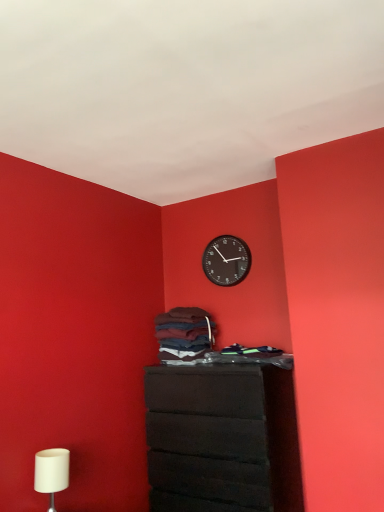
Question: From a real-world perspective, is black plastic wall clock at upper center on white matte table lamp at lower left?

Choices:
 (A) no
 (B) yes

Answer: (B)

Question: Does black plastic wall clock at upper center have a lesser height compared to white matte table lamp at lower left?

Choices:
 (A) no
 (B) yes

Answer: (A)

Question: Would you consider black plastic wall clock at upper center to be distant from white matte table lamp at lower left?

Choices:
 (A) no
 (B) yes

Answer: (B)

Question: Is black plastic wall clock at upper center bigger than white matte table lamp at lower left?

Choices:
 (A) no
 (B) yes

Answer: (A)

Question: Considering the relative sizes of black plastic wall clock at upper center and white matte table lamp at lower left in the image provided, is black plastic wall clock at upper center thinner than white matte table lamp at lower left?

Choices:
 (A) no
 (B) yes

Answer: (B)

Question: Is white matte table lamp at lower left bigger or smaller than matte black chest of drawers at center?

Choices:
 (A) small
 (B) big

Answer: (A)

Question: From a real-world perspective, relative to matte black chest of drawers at center, is white matte table lamp at lower left vertically above or below?

Choices:
 (A) above
 (B) below

Answer: (A)

Question: Considering the positions of white matte table lamp at lower left and matte black chest of drawers at center in the image, is white matte table lamp at lower left taller or shorter than matte black chest of drawers at center?

Choices:
 (A) tall
 (B) short

Answer: (B)

Question: Does point (54, 466) appear closer or farther from the camera than point (278, 371)?

Choices:
 (A) closer
 (B) farther

Answer: (A)

Question: In the image, is dark blue cotton laundry at center positioned in front of or behind white matte table lamp at lower left?

Choices:
 (A) front
 (B) behind

Answer: (B)

Question: Does point (155, 330) appear closer or farther from the camera than point (59, 472)?

Choices:
 (A) farther
 (B) closer

Answer: (A)

Question: Is dark blue cotton laundry at center bigger or smaller than white matte table lamp at lower left?

Choices:
 (A) small
 (B) big

Answer: (B)

Question: Is dark blue cotton laundry at center wider or thinner than white matte table lamp at lower left?

Choices:
 (A) wide
 (B) thin

Answer: (A)

Question: Does point (175, 315) appear closer or farther from the camera than point (231, 239)?

Choices:
 (A) closer
 (B) farther

Answer: (A)

Question: From the image's perspective, is dark blue cotton laundry at center located above or below black plastic wall clock at upper center?

Choices:
 (A) below
 (B) above

Answer: (A)